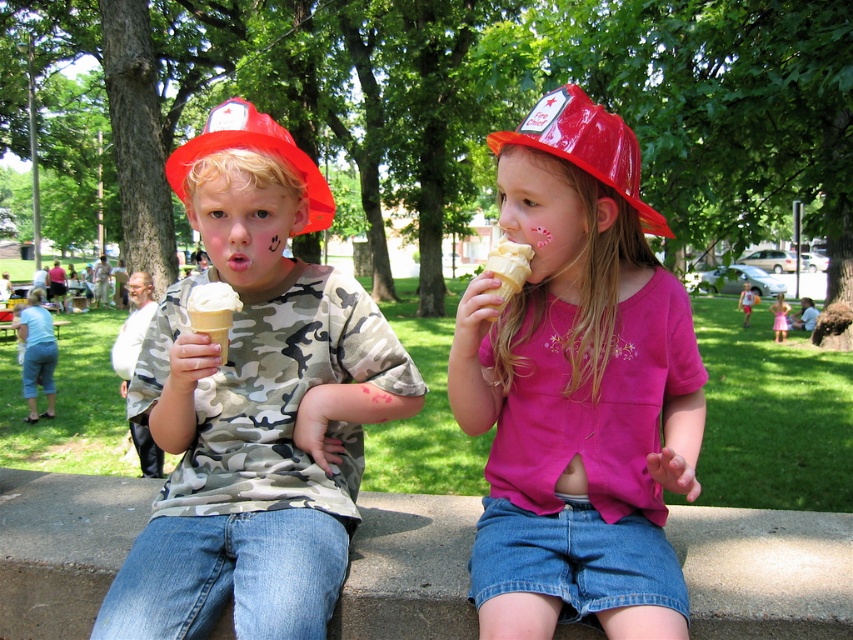
Question: Does pink matte shirt at center appear over red plastic hat at upper center?

Choices:
 (A) yes
 (B) no

Answer: (B)

Question: Which object is positioned farthest from the pink matte shirt at center?

Choices:
 (A) pink satin dress at center
 (B) red plastic hat at upper center
 (C) white creamy ice cream cone at center

Answer: (A)

Question: Can you confirm if red plastic hat at upper center is wider than red plastic fire hat at left?

Choices:
 (A) yes
 (B) no

Answer: (B)

Question: Considering the real-world distances, which object is closest to the pink satin dress at center?

Choices:
 (A) pink matte shirt at center
 (B) white creamy ice cream cone at center
 (C) red plastic hat at upper center
 (D) vanilla ice cream at center

Answer: (D)

Question: Does pink matte shirt at center appear on the left side of white creamy ice cream cone at center?

Choices:
 (A) yes
 (B) no

Answer: (B)

Question: Which object appears farthest from the camera in this image?

Choices:
 (A) white creamy ice cream cone at center
 (B) red plastic hat at upper center
 (C) vanilla ice cream at center
 (D) matte camouflage shirt at center

Answer: (A)